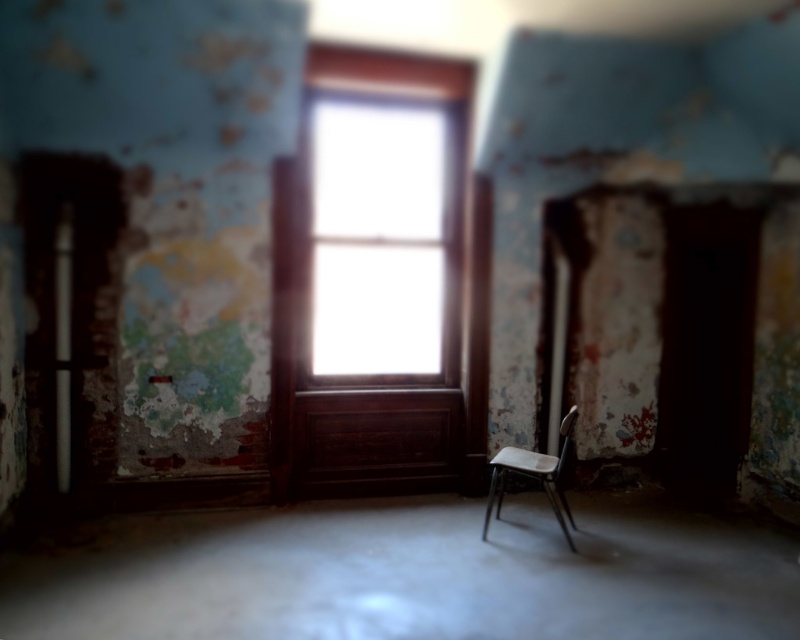
From the picture: Is transparent glass window at center smaller than metallic gray chair at center?

Incorrect, transparent glass window at center is not smaller in size than metallic gray chair at center.

Can you confirm if transparent glass window at center is wider than metallic gray chair at center?

Yes.

Is point (384, 230) in front of point (509, 467)?

No, (384, 230) is further to viewer.

The width and height of the screenshot is (800, 640). I want to click on transparent glass window at center, so click(x=380, y=227).